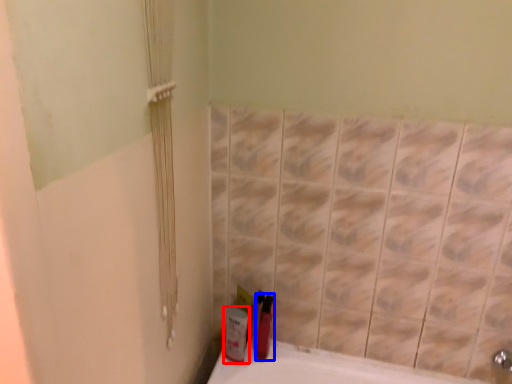
Question: Which of the following is the closest to the observer, mouthwash (highlighted by a red box) or mouthwash (highlighted by a blue box)?

Choices:
 (A) mouthwash
 (B) mouthwash

Answer: (A)